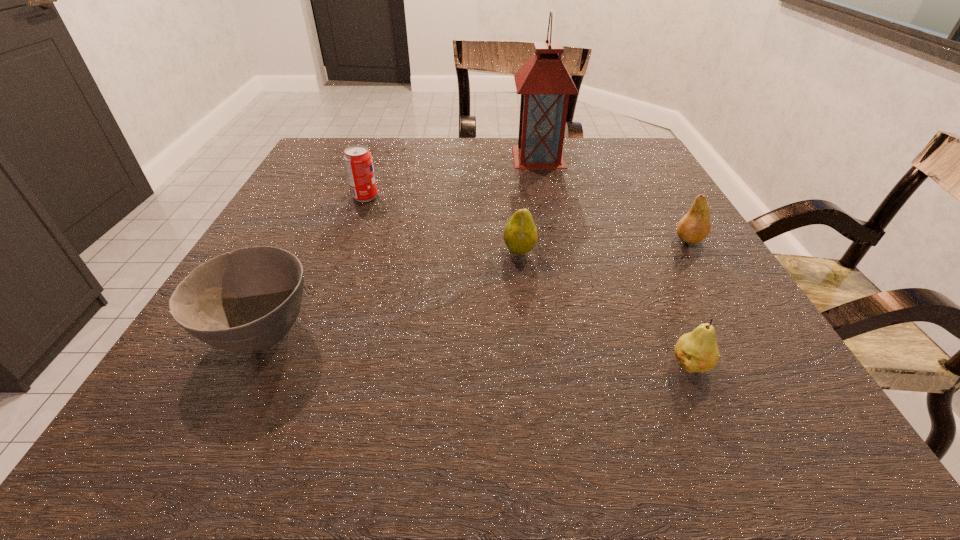
Identify the location of free location located on the left of the rightmost pear. (490, 239).

Locate an element on the screen. free space located 0.100m on the left of the leftmost pear is located at coordinates (451, 251).

Find the location of a particular element. This screenshot has width=960, height=540. vacant space located on the back of the bowl is located at coordinates (321, 212).

Locate an element on the screen. Image resolution: width=960 pixels, height=540 pixels. vacant region located 0.210m on the left of the second object from right to left is located at coordinates (529, 364).

Find the location of a particular element. object that is at the far edge is located at coordinates (544, 83).

The image size is (960, 540). Identify the location of soda can situated at the left edge. (358, 161).

The height and width of the screenshot is (540, 960). Find the location of `bowl present at the left edge`. bowl present at the left edge is located at coordinates (247, 300).

This screenshot has height=540, width=960. I want to click on vacant region at the far edge of the desktop, so click(567, 164).

The height and width of the screenshot is (540, 960). What are the coordinates of `blank space at the near edge of the desktop` in the screenshot? It's located at (506, 443).

Identify the location of vacant space at the left edge of the desktop. (187, 348).